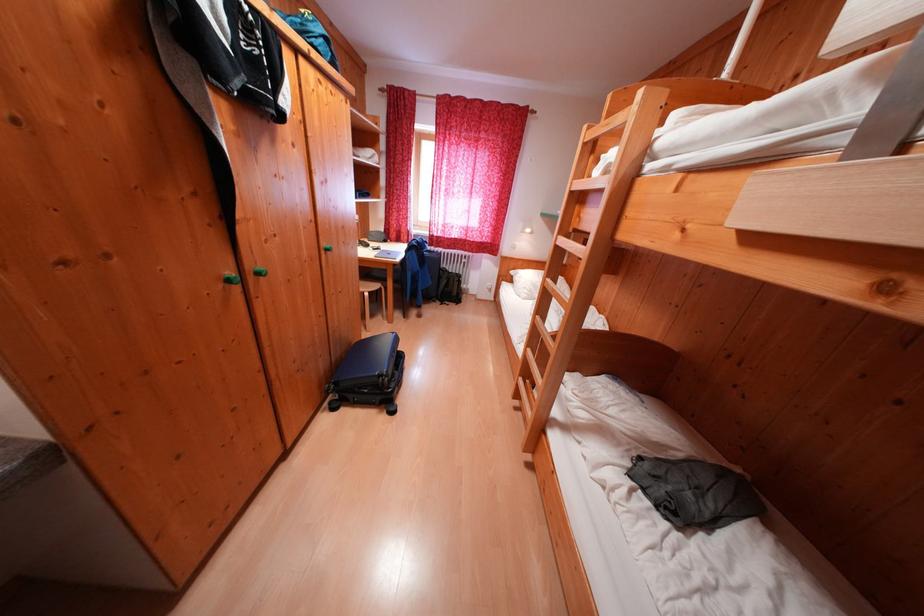
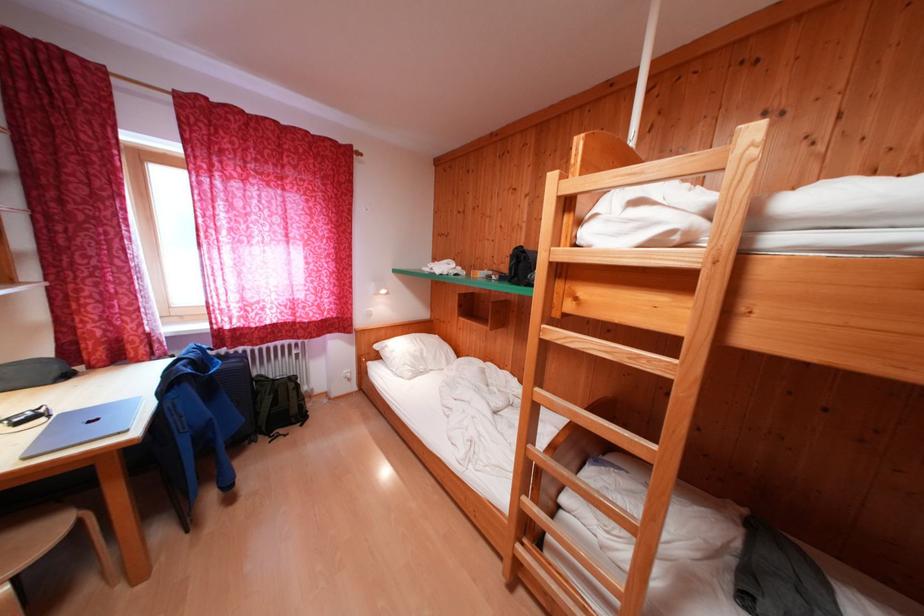
Locate, in the second image, the point that corresponds to the point at 454,275 in the first image.

(271, 383)